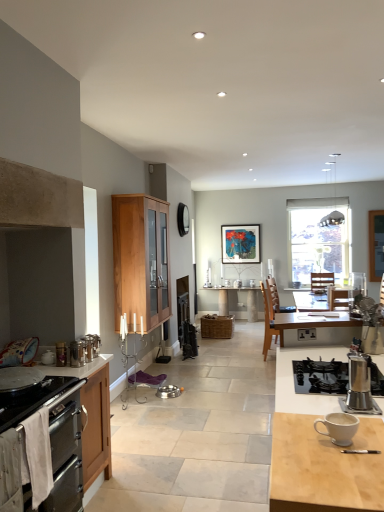
Question: Is stainless steel gas stove at lower left bigger than metallic stainless steel pet bowls at center, which appears as the first kitchen appliance when ordered from the bottom?

Choices:
 (A) yes
 (B) no

Answer: (A)

Question: Considering the relative sizes of stainless steel gas stove at lower left and metallic stainless steel pet bowls at center, which appears as the first kitchen appliance when ordered from the bottom, in the image provided, is stainless steel gas stove at lower left thinner than metallic stainless steel pet bowls at center, which appears as the first kitchen appliance when ordered from the bottom,?

Choices:
 (A) yes
 (B) no

Answer: (B)

Question: Is stainless steel gas stove at lower left looking in the opposite direction of metallic stainless steel pet bowls at center, the 2th kitchen appliance from the top?

Choices:
 (A) yes
 (B) no

Answer: (B)

Question: Can you confirm if stainless steel gas stove at lower left is positioned to the left of metallic stainless steel pet bowls at center, the 2th kitchen appliance from the top?

Choices:
 (A) yes
 (B) no

Answer: (A)

Question: Can you confirm if stainless steel gas stove at lower left is wider than metallic stainless steel pet bowls at center, the second kitchen appliance in the left-to-right sequence?

Choices:
 (A) no
 (B) yes

Answer: (B)

Question: Is stainless steel gas stove at lower left positioned far away from metallic stainless steel pet bowls at center, which appears as the first kitchen appliance when ordered from the bottom?

Choices:
 (A) yes
 (B) no

Answer: (A)

Question: Is matte black picture frame at center positioned far away from stainless steel gas stove at lower left?

Choices:
 (A) no
 (B) yes

Answer: (B)

Question: Is matte black picture frame at center placed right next to stainless steel gas stove at lower left?

Choices:
 (A) no
 (B) yes

Answer: (A)

Question: From the image's perspective, is matte black picture frame at center located above stainless steel gas stove at lower left?

Choices:
 (A) yes
 (B) no

Answer: (A)

Question: Is matte black picture frame at center not inside stainless steel gas stove at lower left?

Choices:
 (A) yes
 (B) no

Answer: (A)

Question: From the image's perspective, would you say matte black picture frame at center is shown under stainless steel gas stove at lower left?

Choices:
 (A) no
 (B) yes

Answer: (A)

Question: Does matte black picture frame at center have a larger size compared to stainless steel gas stove at lower left?

Choices:
 (A) yes
 (B) no

Answer: (A)

Question: From the image's perspective, is metallic stainless steel pet bowls at center, the second kitchen appliance in the left-to-right sequence, located above matte black picture frame at center?

Choices:
 (A) no
 (B) yes

Answer: (A)